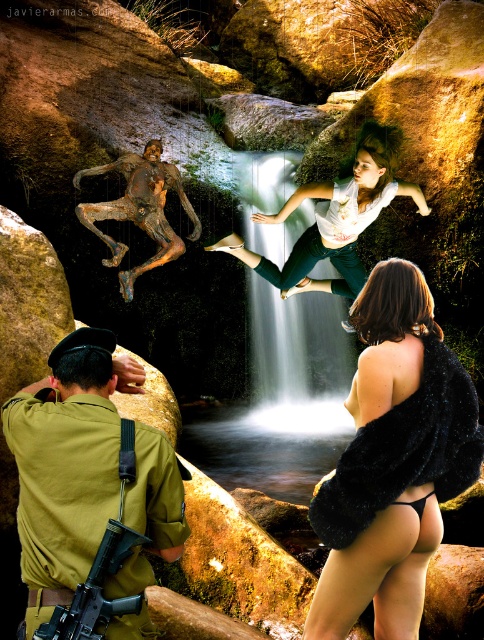
You are a military strategist analyzing the positioning of the white matte shirt at upper center and the matte black rifle at lower left in the image. Given that the distance between them is 3.37 meters, can you determine if a standard military radio with a 1.5 meter range can relay a signal between these two objects?

The white matte shirt at upper center is 3.37 meters away from the matte black rifle at lower left. Since the radio has a 1.5 meter range, the distance is too great for the signal to reach between them.

You are a photographer trying to capture a shot of the black fur coat at lower right and the white matte shirt at upper center. Which object is located to the left of the other?

The black fur coat at lower right is positioned on the left side of white matte shirt at upper center.

You are a photographer trying to capture both the khaki uniform at lower left and the bronze sculpture at center in a single frame. Which object should you focus on first to ensure both are in the frame?

The khaki uniform at lower left occupies less space than the bronze sculpture at center, so you should focus on the bronze sculpture at center first to ensure both are in the frame.